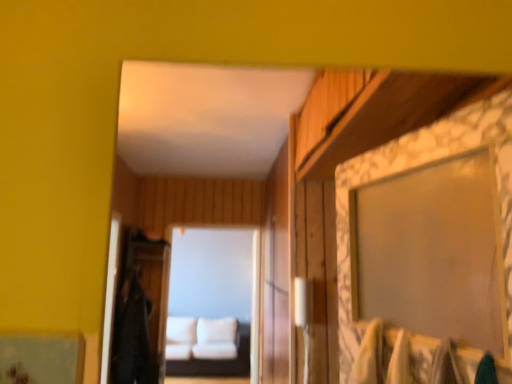
Describe the element at coordinates (133, 336) in the screenshot. I see `black fabric robe at left` at that location.

Describe the element at coordinates (211, 301) in the screenshot. The height and width of the screenshot is (384, 512). I see `white fabric couch at center` at that location.

The width and height of the screenshot is (512, 384). In order to click on white fabric couch at center in this screenshot , I will do [211, 301].

Identify the location of black fabric robe at left. (133, 336).

Is white fabric couch at center at the right side of black fabric robe at left?

Yes, white fabric couch at center is to the right of black fabric robe at left.

Considering the positions of point (216, 360) and point (134, 320), is point (216, 360) closer or farther from the camera than point (134, 320)?

Point (216, 360) appears to be farther away from the viewer than point (134, 320).

At what (x,y) coordinates should I click in order to perform the action: click on robe above the white fabric couch at center (from a real-world perspective). Please return your answer as a coordinate pair (x, y). This screenshot has width=512, height=384. Looking at the image, I should click on (133, 336).

Which is in front, white fabric couch at center or white fabric couch at center?

white fabric couch at center.

Measure the distance from white fabric couch at center to white fabric couch at center.

The distance of white fabric couch at center from white fabric couch at center is 21.63 inches.

From a real-world perspective, does white fabric couch at center sit lower than white fabric couch at center?

Yes, from a real-world perspective, white fabric couch at center is beneath white fabric couch at center.

Could you tell me if white fabric couch at center is turned towards white fabric couch at center?

Yes, white fabric couch at center faces towards white fabric couch at center.

Is white fabric couch at center not within white fabric couch at center?

Yes, white fabric couch at center is outside of white fabric couch at center.

Considering the sizes of objects white fabric couch at center and white fabric couch at center in the image provided, who is thinner, white fabric couch at center or white fabric couch at center?

white fabric couch at center.

From a real-world perspective, is white fabric couch at center physically located above or below white fabric couch at center?

In terms of real-world spatial position, white fabric couch at center is above white fabric couch at center.

Which is behind, black fabric robe at left or white fabric couch at center?

white fabric couch at center is more distant.

Which is in front, point (121, 320) or point (237, 318)?

The point (121, 320) is closer to the camera.

Would you say black fabric robe at left is outside white fabric couch at center?

That's correct, black fabric robe at left is outside of white fabric couch at center.

In the scene shown: What's the angular difference between black fabric robe at left and white fabric couch at center's facing directions?

There is a 93.7-degree angle between the facing directions of black fabric robe at left and white fabric couch at center.

Would you say white fabric couch at center is inside or outside black fabric robe at left?

white fabric couch at center is not enclosed by black fabric robe at left.

Considering the relative positions of white fabric couch at center and black fabric robe at left in the image provided, is white fabric couch at center behind black fabric robe at left?

Answer: Yes.

From a real-world perspective, is white fabric couch at center under black fabric robe at left?

No, from a real-world perspective, white fabric couch at center is not below black fabric robe at left.

Between black fabric robe at left and white fabric couch at center, which one has more height?

black fabric robe at left.

Is black fabric robe at left inside the boundaries of white fabric couch at center, or outside?

black fabric robe at left is spatially situated outside white fabric couch at center.

Does black fabric robe at left turn towards white fabric couch at center?

No, black fabric robe at left is not oriented towards white fabric couch at center.

Is black fabric robe at left smaller than white fabric couch at center?

Yes, black fabric robe at left is smaller than white fabric couch at center.

In order to click on couch that appears below the black fabric robe at left (from a real-world perspective) in this screenshot , I will do `click(217, 361)`.

The height and width of the screenshot is (384, 512). Identify the location of mirror on the right of the white fabric couch at center. (211, 301).

Which object lies further to the anchor point black fabric robe at left, white fabric couch at center or white fabric couch at center?

white fabric couch at center.

When comparing their distances from white fabric couch at center, does white fabric couch at center or black fabric robe at left seem further?

The object further to white fabric couch at center is black fabric robe at left.

Considering their positions, is white fabric couch at center positioned further to black fabric robe at left than white fabric couch at center?

white fabric couch at center is further to black fabric robe at left.

Estimate the real-world distances between objects in this image. Which object is further from white fabric couch at center, white fabric couch at center or black fabric robe at left?

black fabric robe at left lies further to white fabric couch at center than the other object.

Looking at the image, which one is located further to white fabric couch at center, black fabric robe at left or white fabric couch at center?

Based on the image, black fabric robe at left appears to be further to white fabric couch at center.

Looking at the image, which one is located further to white fabric couch at center, black fabric robe at left or white fabric couch at center?

Among the two, black fabric robe at left is located further to white fabric couch at center.

Image resolution: width=512 pixels, height=384 pixels. In order to click on mirror between black fabric robe at left and white fabric couch at center in the front-back direction in this screenshot , I will do `click(211, 301)`.